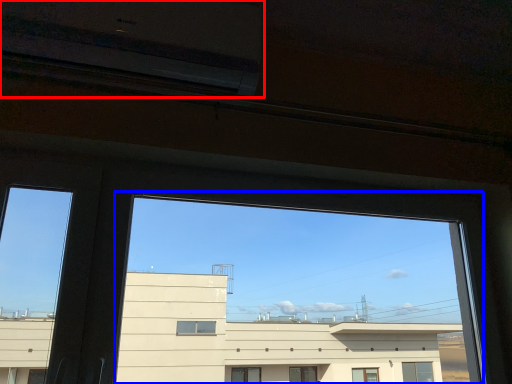
Question: Which of the following is the closest to the observer, air conditioning (highlighted by a red box) or train window (highlighted by a blue box)?

Choices:
 (A) air conditioning
 (B) train window

Answer: (B)